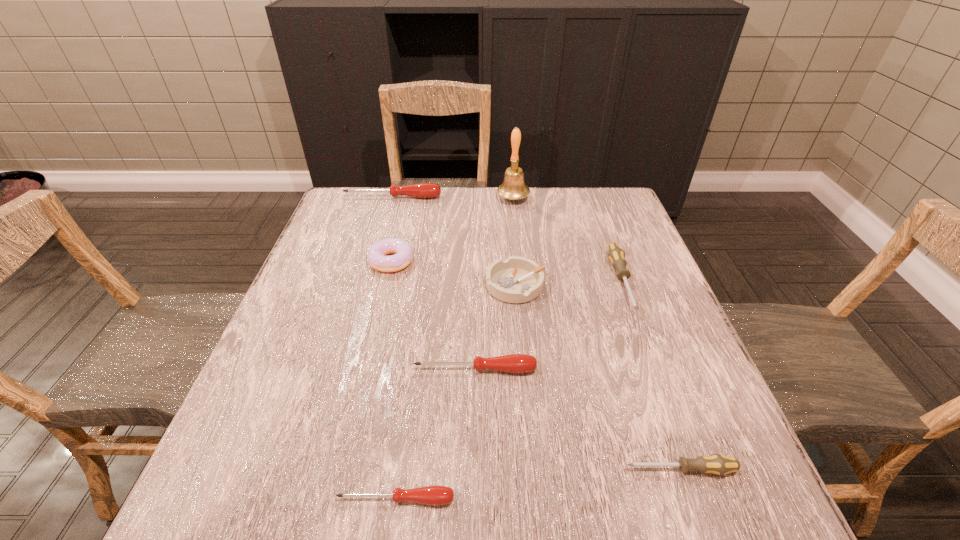
At what (x,y) coordinates should I click in order to perform the action: click on free spot between the tallest object and the doughnut. Please return your answer as a coordinate pair (x, y). This screenshot has width=960, height=540. Looking at the image, I should click on (452, 230).

I want to click on empty space between the tallest object and the nearer gray screwdriver, so click(x=597, y=334).

Identify the location of vacant area between the doughnut and the second farthest red screwdriver. This screenshot has width=960, height=540. (433, 315).

You are a GUI agent. You are given a task and a screenshot of the screen. Output one action in this format:
    pyautogui.click(x=<x>, y=<y>)
    Task: Click on the free space that is in between the third nearest screwdriver and the farthest red screwdriver
    This screenshot has width=960, height=540.
    Given the screenshot: What is the action you would take?
    pyautogui.click(x=434, y=284)

Where is `empty space between the bigger gray screwdriver and the sixth farthest object`? The image size is (960, 540). empty space between the bigger gray screwdriver and the sixth farthest object is located at coordinates (548, 326).

Image resolution: width=960 pixels, height=540 pixels. I want to click on vacant space in between the second nearest object and the farthest red screwdriver, so click(x=537, y=333).

This screenshot has height=540, width=960. In order to click on object that is the third closest to the smaller gray screwdriver in this screenshot , I will do `click(616, 255)`.

This screenshot has height=540, width=960. In order to click on object that stands as the fifth closest to the tallest object in this screenshot , I will do `click(514, 363)`.

Identify which screwdriver is the fourth nearest to the shortest screwdriver. Please provide its 2D coordinates. Your answer should be formatted as a tuple, i.e. [(x, y)], where the tuple contains the x and y coordinates of a point satisfying the conditions above.

[(422, 190)]

Find the location of a particular element. screwdriver that is the third nearest to the ashtray is located at coordinates (422, 190).